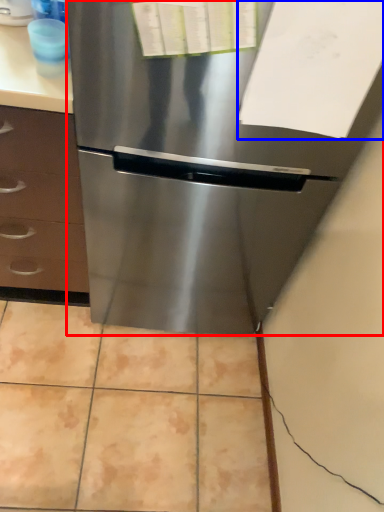
Question: Which object is further to the camera taking this photo, refrigerator (highlighted by a red box) or paper (highlighted by a blue box)?

Choices:
 (A) refrigerator
 (B) paper

Answer: (B)